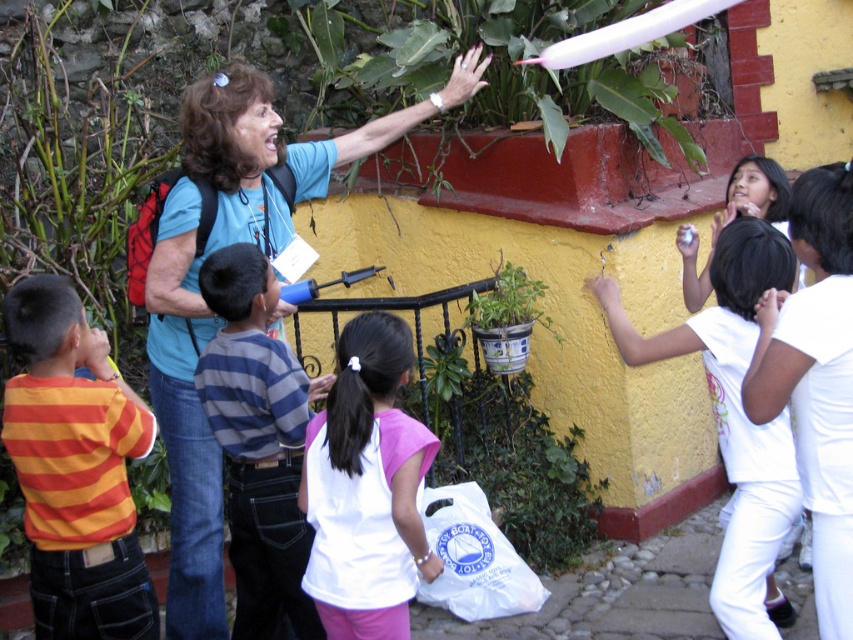
You are a photographer trying to capture a photo of the orange striped shirt at left and the striped fabric shirt at center. Which one should you focus on first if you want to include both in your frame without moving the camera?

The orange striped shirt at left is shorter than the striped fabric shirt at center, so you should focus on the orange striped shirt at left first to ensure it is in frame before the taller striped fabric shirt at center.

You are standing in the scene and want to find the orange striped shirt at left. According to the coordinates given, where should you look relative to the center of the image?

The orange striped shirt at left is located at coordinates point (74, 468), which is to the upper left of the center of the image.